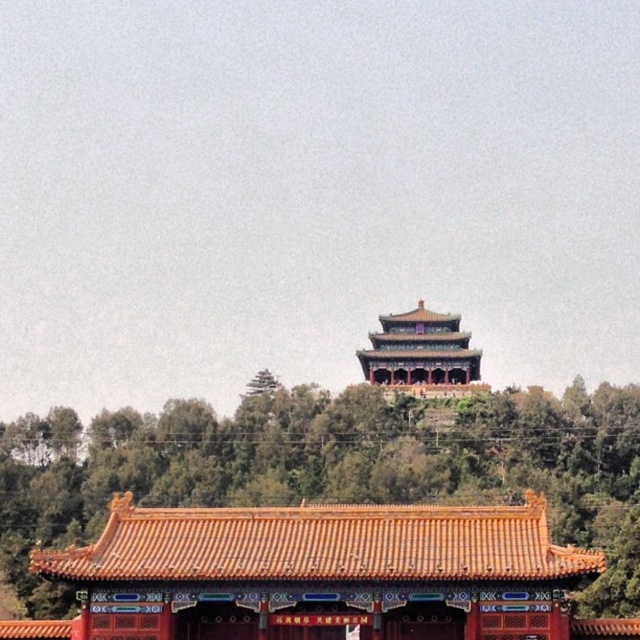
Question: Which point appears closest to the camera in this image?

Choices:
 (A) (493, 557)
 (B) (396, 349)

Answer: (A)

Question: Does orange glazed tile roof at center have a smaller size compared to orange glazed tile palace at center?

Choices:
 (A) yes
 (B) no

Answer: (B)

Question: Among these points, which one is farthest from the camera?

Choices:
 (A) (92, 636)
 (B) (410, 312)

Answer: (B)

Question: Does orange glazed tile roof at center lie behind orange glazed tile palace at center?

Choices:
 (A) yes
 (B) no

Answer: (B)

Question: Among these objects, which one is farthest from the camera?

Choices:
 (A) orange glazed tile roof at center
 (B) orange glazed tile palace at center

Answer: (B)

Question: Can you confirm if orange glazed tile roof at center is positioned above orange glazed tile palace at center?

Choices:
 (A) no
 (B) yes

Answer: (A)